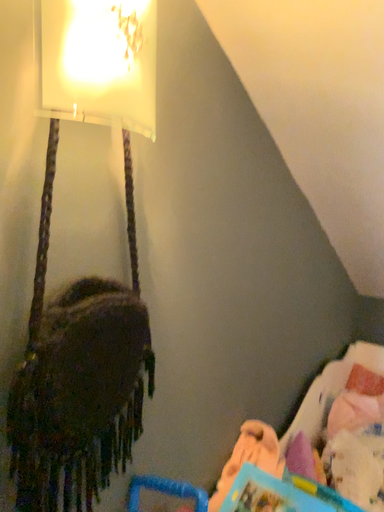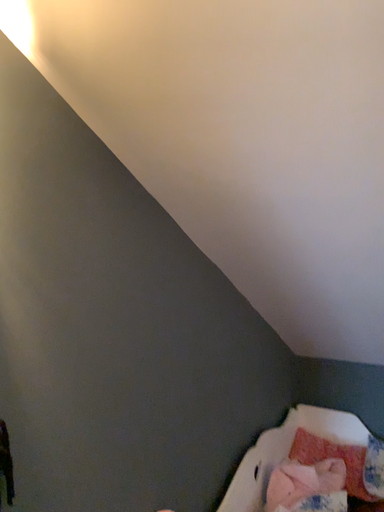
Question: How did the camera likely rotate when shooting the video?

Choices:
 (A) rotated upward
 (B) rotated downward

Answer: (A)